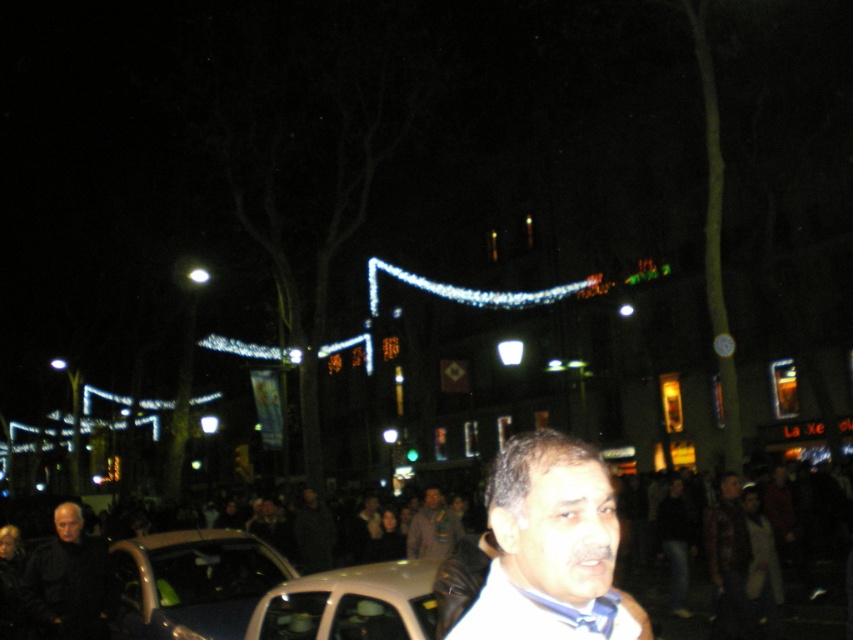
Question: Does white satin shirt at lower center appear on the right side of blue silk tie at center?

Choices:
 (A) yes
 (B) no

Answer: (B)

Question: Which object is the closest to the metallic silver car at lower left?

Choices:
 (A) matte beige car at lower center
 (B) white satin shirt at lower center
 (C) gray wool coat at center
 (D) blue silk tie at center

Answer: (A)

Question: Is gray wool coat at center above blue silk tie at center?

Choices:
 (A) yes
 (B) no

Answer: (B)

Question: Which point is farther to the camera?

Choices:
 (A) dark matte jacket at lower left
 (B) white matte jacket at center

Answer: (A)

Question: Observing the image, what is the correct spatial positioning of white satin shirt at lower center in reference to blue silk tie at center?

Choices:
 (A) above
 (B) below

Answer: (B)

Question: Estimate the real-world distances between objects in this image. Which object is farther from the metallic silver car at lower left?

Choices:
 (A) blue silk tie at center
 (B) white matte jacket at center

Answer: (A)